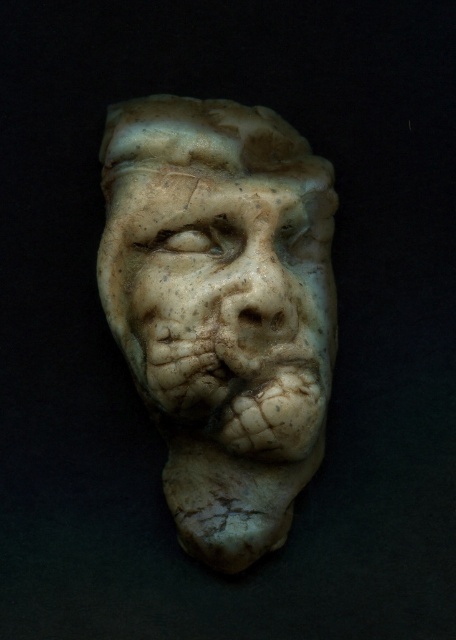
Between white marble sculpture at center and marble sculpture of face at center, which one is positioned lower?

white marble sculpture at center is below.

Between white marble sculpture at center and marble sculpture of face at center, which one appears on the right side from the viewer's perspective?

Positioned to the right is marble sculpture of face at center.

Does point (295, 230) lie in front of point (208, 276)?

That is False.

In order to click on white marble sculpture at center in this screenshot , I will do `click(222, 308)`.